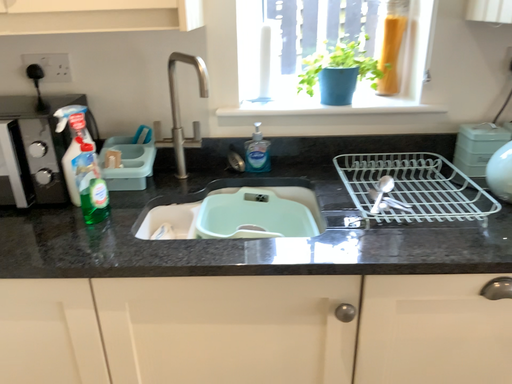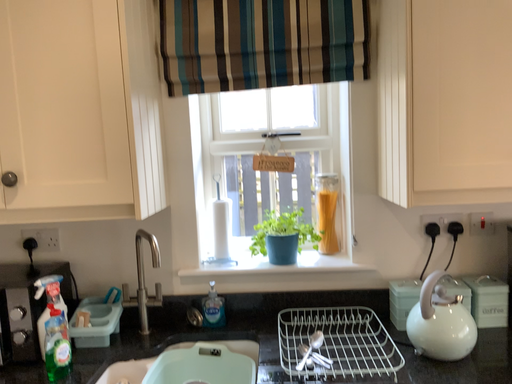
Question: Which way did the camera rotate in the video?

Choices:
 (A) rotated downward
 (B) rotated upward

Answer: (B)